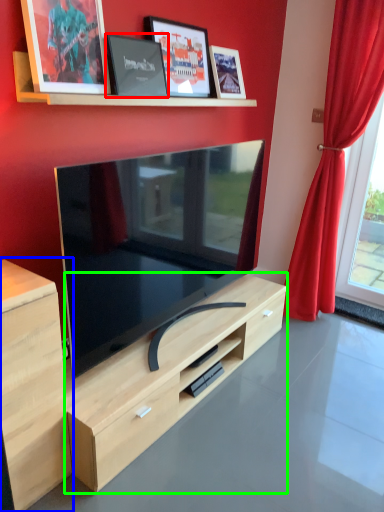
Question: Based on their relative distances, which object is nearer to picture frame (highlighted by a red box)? Choose from cabinetry (highlighted by a blue box) and dresser (highlighted by a green box).

Choices:
 (A) cabinetry
 (B) dresser

Answer: (A)